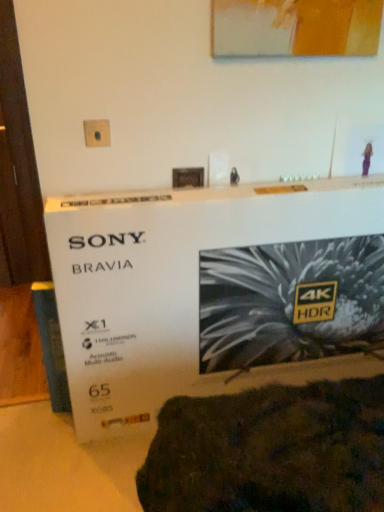
Question: Would you say matte plastic outlet at upper center contains white cardboard box at center?

Choices:
 (A) yes
 (B) no

Answer: (B)

Question: Are matte plastic outlet at upper center and white cardboard box at center far apart?

Choices:
 (A) no
 (B) yes

Answer: (A)

Question: Is the depth of matte plastic outlet at upper center less than that of white cardboard box at center?

Choices:
 (A) no
 (B) yes

Answer: (A)

Question: Is matte plastic outlet at upper center turned away from white cardboard box at center?

Choices:
 (A) no
 (B) yes

Answer: (A)

Question: From the image's perspective, is matte plastic outlet at upper center located beneath white cardboard box at center?

Choices:
 (A) no
 (B) yes

Answer: (A)

Question: Is matte plastic outlet at upper center located outside white cardboard box at center?

Choices:
 (A) no
 (B) yes

Answer: (B)

Question: From a real-world perspective, is white cardboard box at center located higher than matte plastic outlet at upper center?

Choices:
 (A) yes
 (B) no

Answer: (B)

Question: Does white cardboard box at center have a smaller size compared to matte plastic outlet at upper center?

Choices:
 (A) no
 (B) yes

Answer: (A)

Question: Does white cardboard box at center have a greater height compared to matte plastic outlet at upper center?

Choices:
 (A) yes
 (B) no

Answer: (A)

Question: Is white cardboard box at center far away from matte plastic outlet at upper center?

Choices:
 (A) yes
 (B) no

Answer: (B)

Question: Is white cardboard box at center thinner than matte plastic outlet at upper center?

Choices:
 (A) yes
 (B) no

Answer: (B)

Question: Considering the relative positions of white cardboard box at center and matte plastic outlet at upper center in the image provided, is white cardboard box at center in front of matte plastic outlet at upper center?

Choices:
 (A) yes
 (B) no

Answer: (A)

Question: Can you confirm if white cardboard box at center is taller than matte acrylic picture frame at upper center?

Choices:
 (A) no
 (B) yes

Answer: (B)